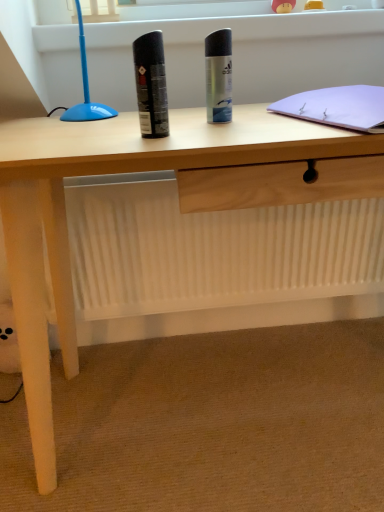
Question: Can you confirm if black matte can at center, the 2th stationery viewed from the back, is positioned to the left of silver metallic deodorant can at center, which is the first stationery from back to front?

Choices:
 (A) no
 (B) yes

Answer: (B)

Question: Is black matte can at center, marked as the second stationery in a right-to-left arrangement, next to silver metallic deodorant can at center, which is the first stationery from back to front, and touching it?

Choices:
 (A) no
 (B) yes

Answer: (A)

Question: Does black matte can at center, positioned as the first stationery in left-to-right order, have a greater height compared to silver metallic deodorant can at center, the 2th stationery in the left-to-right sequence?

Choices:
 (A) yes
 (B) no

Answer: (B)

Question: Does black matte can at center, positioned as the first stationery in left-to-right order, have a greater width compared to silver metallic deodorant can at center, arranged as the second stationery when viewed from the front?

Choices:
 (A) no
 (B) yes

Answer: (A)

Question: Considering the relative sizes of black matte can at center, the 2th stationery viewed from the back, and silver metallic deodorant can at center, the 2th stationery in the left-to-right sequence, in the image provided, is black matte can at center, the 2th stationery viewed from the back, bigger than silver metallic deodorant can at center, the 2th stationery in the left-to-right sequence,?

Choices:
 (A) yes
 (B) no

Answer: (B)

Question: Relative to black matte can at center, the 2th stationery viewed from the back, is silver metallic deodorant can at center, arranged as the second stationery when viewed from the front, in front or behind?

Choices:
 (A) behind
 (B) front

Answer: (A)

Question: Is silver metallic deodorant can at center, arranged as the first stationery when viewed from the right, spatially inside black matte can at center, the 2th stationery viewed from the back, or outside of it?

Choices:
 (A) inside
 (B) outside

Answer: (B)

Question: Considering the positions of silver metallic deodorant can at center, the 2th stationery in the left-to-right sequence, and black matte can at center, which is the first stationery in front-to-back order, in the image, is silver metallic deodorant can at center, the 2th stationery in the left-to-right sequence, taller or shorter than black matte can at center, which is the first stationery in front-to-back order,?

Choices:
 (A) short
 (B) tall

Answer: (B)

Question: From a real-world perspective, is silver metallic deodorant can at center, arranged as the second stationery when viewed from the front, positioned above or below black matte can at center, which is the first stationery in front-to-back order?

Choices:
 (A) above
 (B) below

Answer: (B)

Question: From a real-world perspective, is silver metallic deodorant can at center, arranged as the first stationery when viewed from the right, above or below white paper notebook at upper right?

Choices:
 (A) below
 (B) above

Answer: (B)

Question: In terms of size, does silver metallic deodorant can at center, the 2th stationery in the left-to-right sequence, appear bigger or smaller than white paper notebook at upper right?

Choices:
 (A) small
 (B) big

Answer: (A)

Question: Is point (226, 48) closer or farther from the camera than point (357, 128)?

Choices:
 (A) farther
 (B) closer

Answer: (A)

Question: Considering the positions of silver metallic deodorant can at center, arranged as the second stationery when viewed from the front, and white paper notebook at upper right in the image, is silver metallic deodorant can at center, arranged as the second stationery when viewed from the front, wider or thinner than white paper notebook at upper right?

Choices:
 (A) thin
 (B) wide

Answer: (A)

Question: Based on their sizes in the image, would you say black matte can at center, positioned as the first stationery in left-to-right order, is bigger or smaller than silver metallic deodorant can at center, the 2th stationery in the left-to-right sequence?

Choices:
 (A) small
 (B) big

Answer: (A)

Question: Is black matte can at center, marked as the second stationery in a right-to-left arrangement, taller or shorter than silver metallic deodorant can at center, arranged as the second stationery when viewed from the front?

Choices:
 (A) tall
 (B) short

Answer: (B)